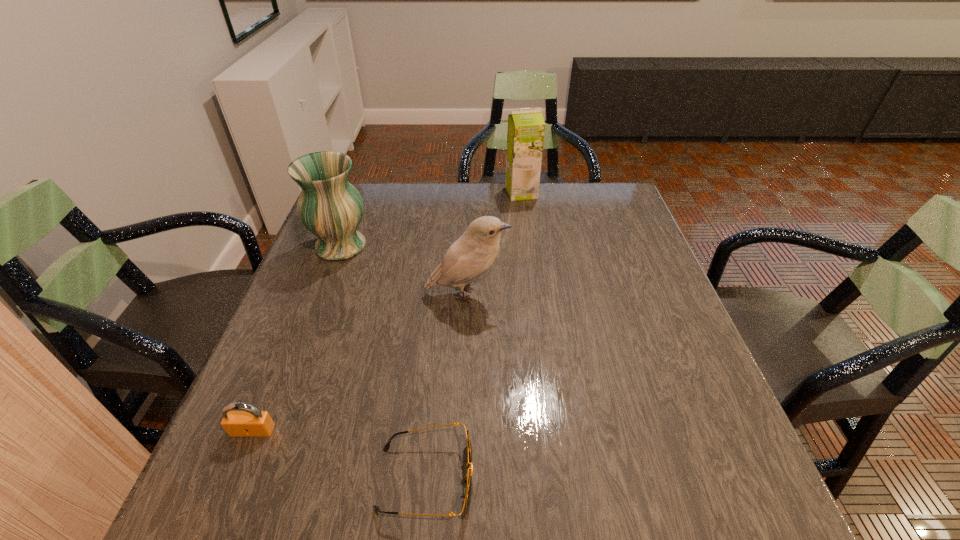
Where is `free space between the shortest object and the vase`? free space between the shortest object and the vase is located at coordinates (383, 362).

Identify which object is the fourth nearest to the rightmost object. Please provide its 2D coordinates. Your answer should be formatted as a tuple, i.e. [(x, y)], where the tuple contains the x and y coordinates of a point satisfying the conditions above.

[(248, 422)]

Point out which object is positioned as the third nearest to the soya milk. Please provide its 2D coordinates. Your answer should be formatted as a tuple, i.e. [(x, y)], where the tuple contains the x and y coordinates of a point satisfying the conditions above.

[(467, 479)]

Where is `free space that satisfies the following two spatial constraints: 1. at the beak of the third nearest object; 2. to unlock the fourth tallest object from the front`? This screenshot has height=540, width=960. free space that satisfies the following two spatial constraints: 1. at the beak of the third nearest object; 2. to unlock the fourth tallest object from the front is located at coordinates (463, 431).

Where is `vacant space that satisfies the following two spatial constraints: 1. at the beak of the third farthest object; 2. to unlock the second shortest object from the front`? vacant space that satisfies the following two spatial constraints: 1. at the beak of the third farthest object; 2. to unlock the second shortest object from the front is located at coordinates (463, 431).

Image resolution: width=960 pixels, height=540 pixels. I want to click on vacant space that satisfies the following two spatial constraints: 1. at the beak of the bird; 2. to unlock the second shortest object from the front, so click(463, 431).

Identify the location of vacant area in the image that satisfies the following two spatial constraints: 1. on the front side of the soya milk; 2. on the front-facing side of the shortest object. (559, 479).